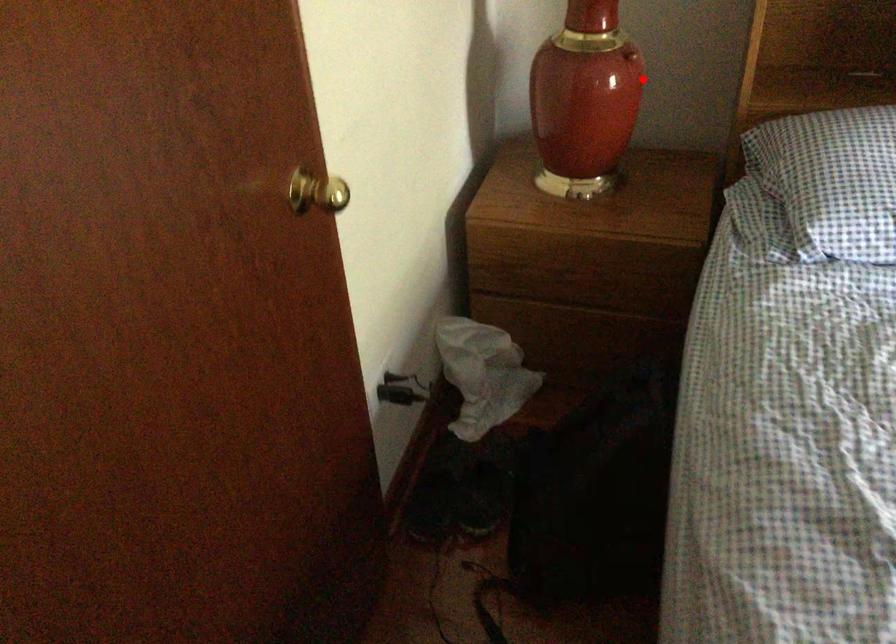
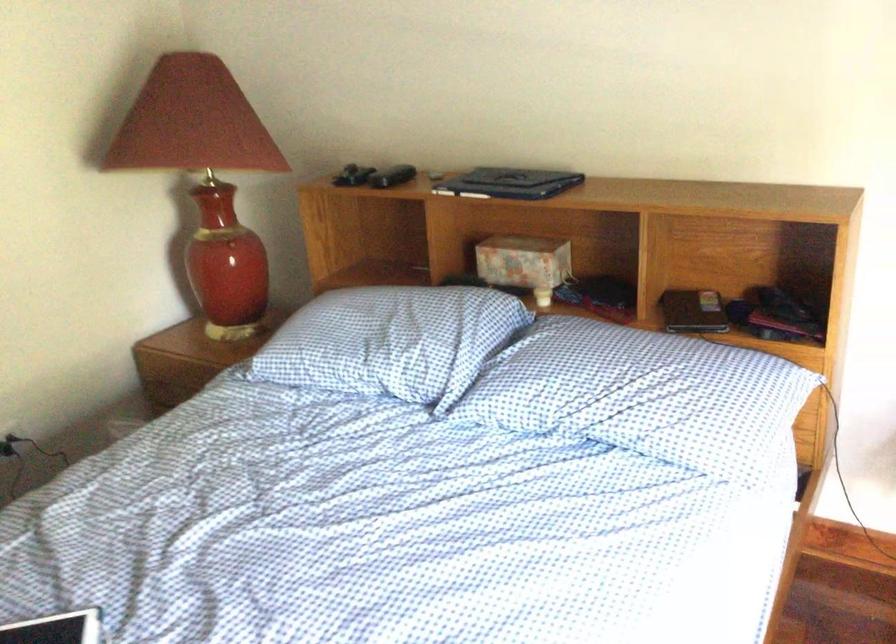
In the second image, find the point that corresponds to the highlighted location in the first image.

(229, 249)